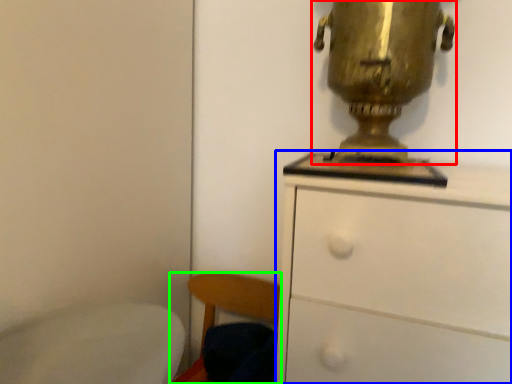
Question: Which object is the farthest from table lamp (highlighted by a red box)? Choose among these: chest of drawers (highlighted by a blue box) or chair (highlighted by a green box).

Choices:
 (A) chest of drawers
 (B) chair

Answer: (B)